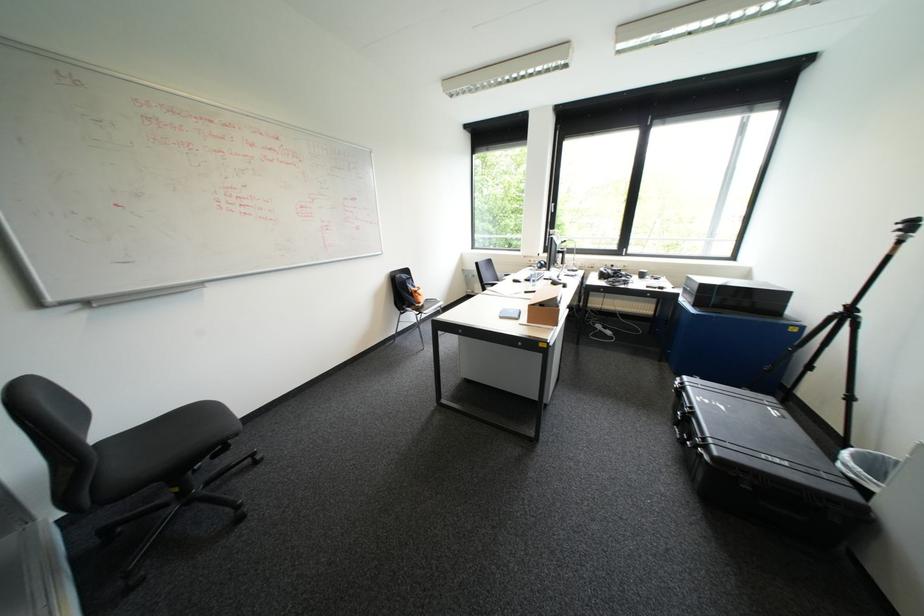
The width and height of the screenshot is (924, 616). What are the coordinates of `black case handle` in the screenshot? It's located at (681, 432).